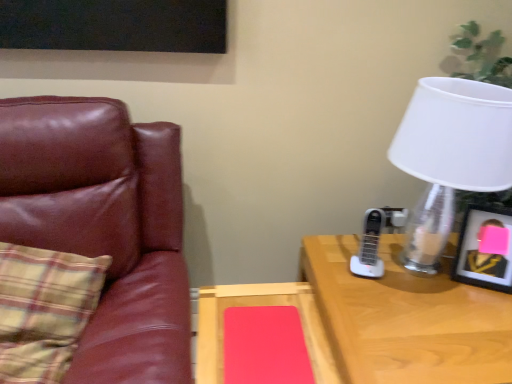
Find the location of `free spot to the left of white matte lampshade at upper right`. free spot to the left of white matte lampshade at upper right is located at coordinates (342, 273).